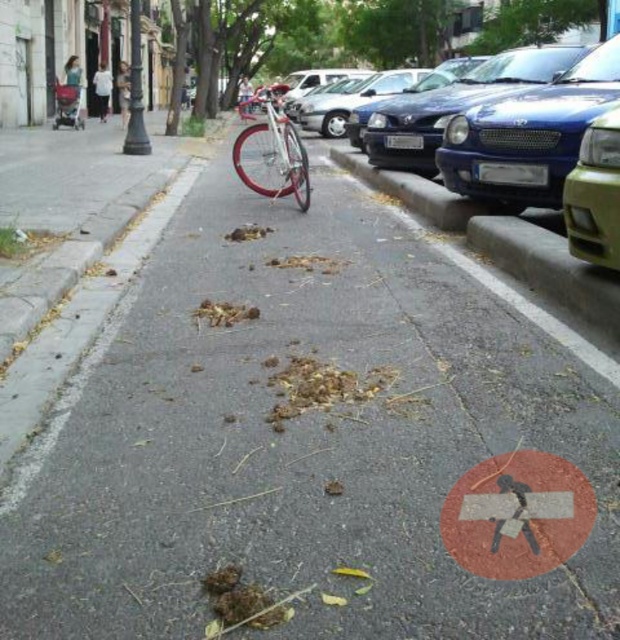
You are a delivery person on a shiny silver bicycle at center, approaching the red painted pedestrian crossing sign at lower center. Which side of the bicycle will the sign be on as you pass by?

The red painted pedestrian crossing sign at lower center is positioned on the right side of shiny silver bicycle at center, so as you ride past, the sign will be on your right side.

You are a delivery person who needs to cross the street. You see the red painted pedestrian crossing sign at lower center and the shiny silver bicycle at center. Which object is narrower?

The red painted pedestrian crossing sign at lower center has a lesser width compared to the shiny silver bicycle at center, so the red painted pedestrian crossing sign at lower center is narrower.

You are a delivery driver who needs to stop at the red painted pedestrian crossing sign at lower center. Given that your car is 1.8 meters wide, can you safely park your car on the right side of the street without blocking the pedestrian crossing sign? Please explain your reasoning.

The red painted pedestrian crossing sign at lower center is located at coordinates point (516, 515). Since the car is 1.8 meters wide and parked on the right side of the street, the driver must ensure that parking does not obstruct the sign. However, without knowing the exact dimensions of the parking space or the distance between the sign and the parking area, it is impossible to determine if the car will block the sign. Additional information about the layout is needed to confirm safety.